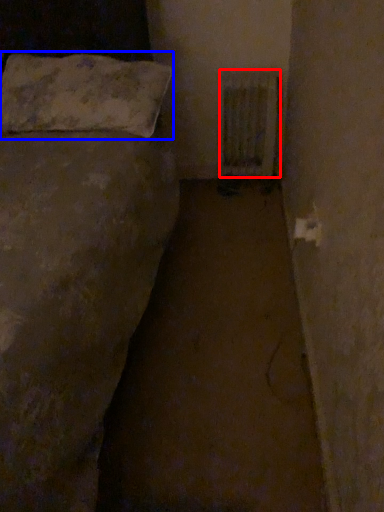
Question: Which of the following is the farthest to the observer, radiator (highlighted by a red box) or pillow (highlighted by a blue box)?

Choices:
 (A) radiator
 (B) pillow

Answer: (A)